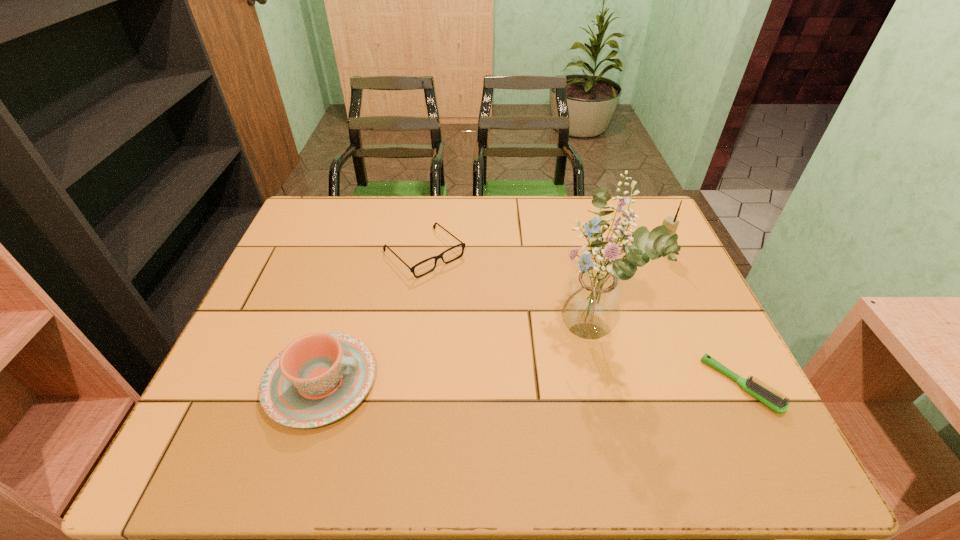
Where is `the third tallest object`? The height and width of the screenshot is (540, 960). the third tallest object is located at coordinates (319, 378).

This screenshot has height=540, width=960. Find the location of `the shortest object`. the shortest object is located at coordinates (772, 400).

I want to click on bouquet, so click(x=592, y=302).

Locate an element on the screen. the tallest object is located at coordinates (592, 302).

Find the location of `spectacles`. spectacles is located at coordinates (412, 269).

Where is `the fourth shortest object`? the fourth shortest object is located at coordinates (671, 223).

This screenshot has height=540, width=960. Find the location of `vacant space situated on the handle side of the chinaware`. vacant space situated on the handle side of the chinaware is located at coordinates (517, 382).

Locate an element on the screen. blank space located on the back of the shortest object is located at coordinates (684, 272).

This screenshot has width=960, height=540. Find the location of `vacant region located on the front-facing side of the third object from right to left`. vacant region located on the front-facing side of the third object from right to left is located at coordinates (478, 402).

At what (x,y) coordinates should I click in order to perform the action: click on vacant space positioned on the front-facing side of the third object from right to left. Please return your answer as a coordinate pair (x, y). Looking at the image, I should click on (466, 409).